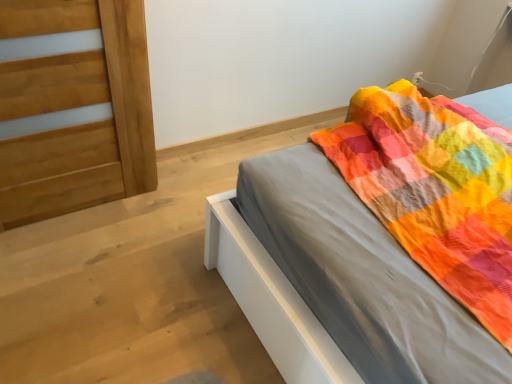
Find the location of a particular element. The height and width of the screenshot is (384, 512). spots to the right of light brown wood door at left is located at coordinates (145, 238).